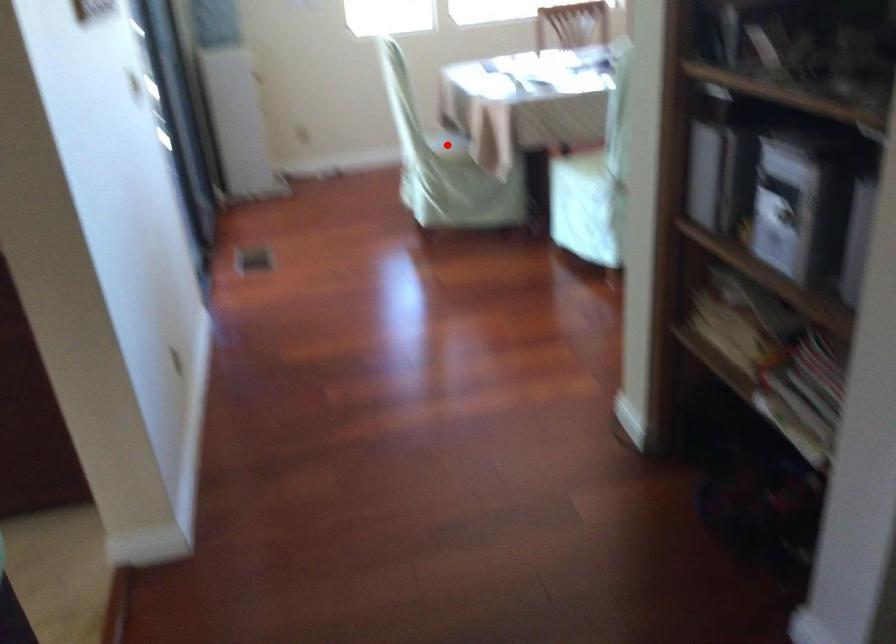
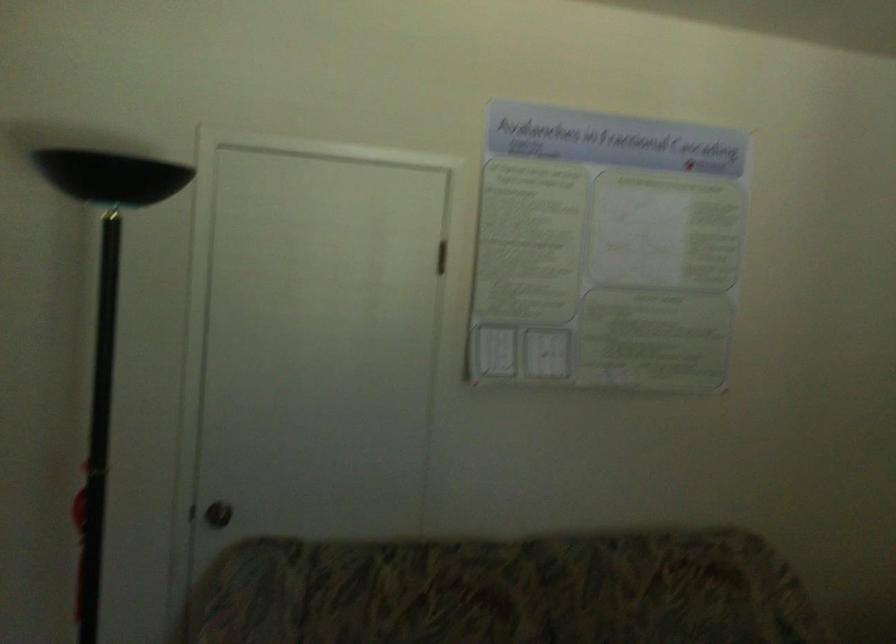
Question: I am providing you with two images of the same scene from different viewpoints. A red point is marked on the first image. Is the red point's position out of view in image 2?

Choices:
 (A) Yes
 (B) No

Answer: (A)